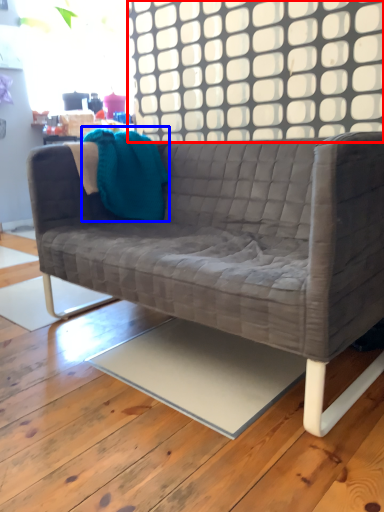
Question: Which object appears farthest to the camera in this image, window (highlighted by a red box) or throw pillow (highlighted by a blue box)?

Choices:
 (A) window
 (B) throw pillow

Answer: (B)